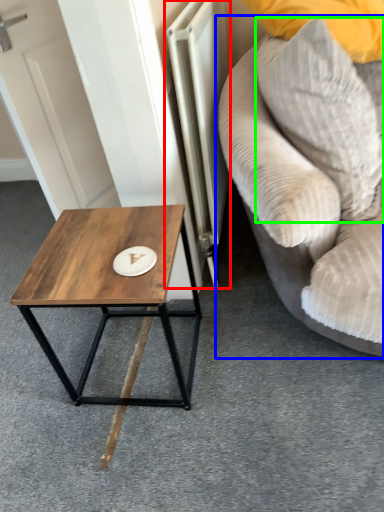
Question: Based on their relative distances, which object is farther from radiator (highlighted by a red box)? Choose from studio couch (highlighted by a blue box) and pillow (highlighted by a green box).

Choices:
 (A) studio couch
 (B) pillow

Answer: (B)